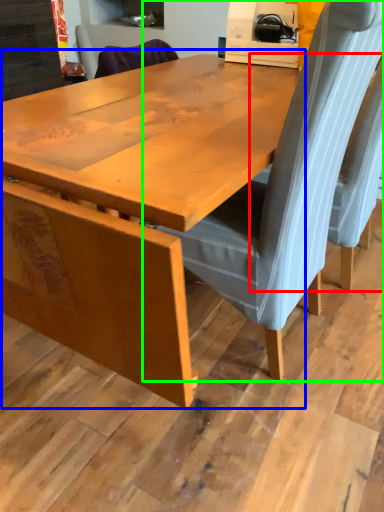
Question: Which object is the farthest from chair (highlighted by a red box)? Choose among these: table (highlighted by a blue box) or chair (highlighted by a green box).

Choices:
 (A) table
 (B) chair

Answer: (A)